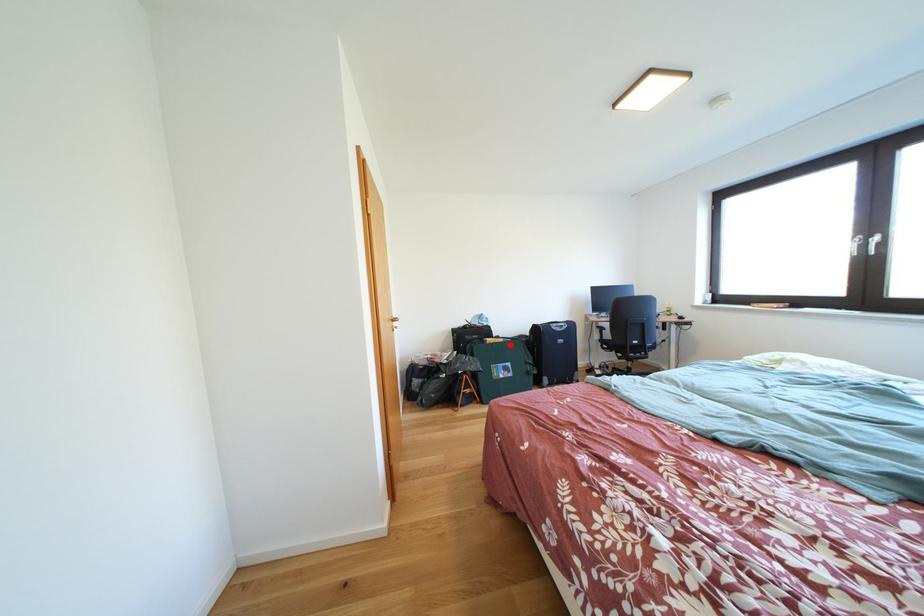
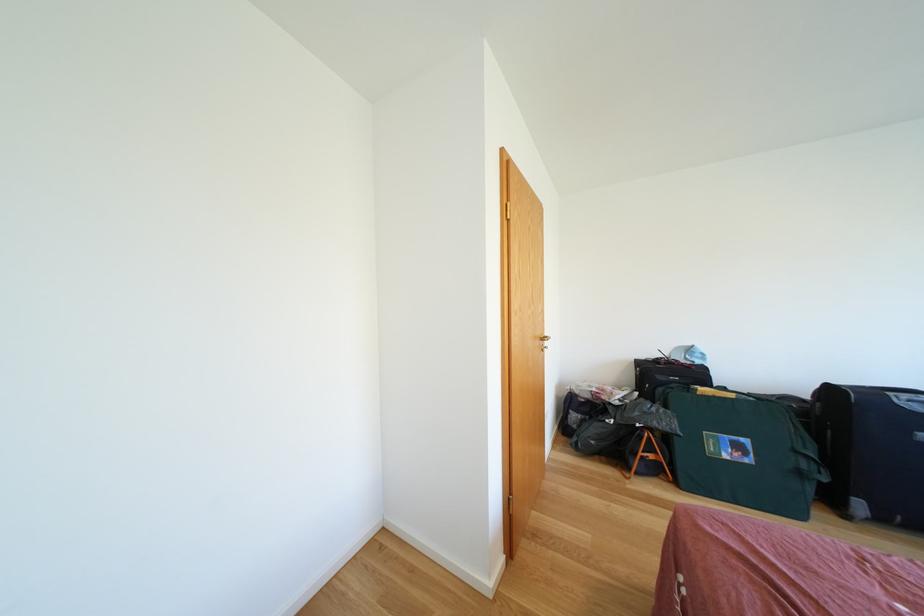
The point at the highlighted location is marked in the first image. Where is the corresponding point in the second image?

(739, 400)